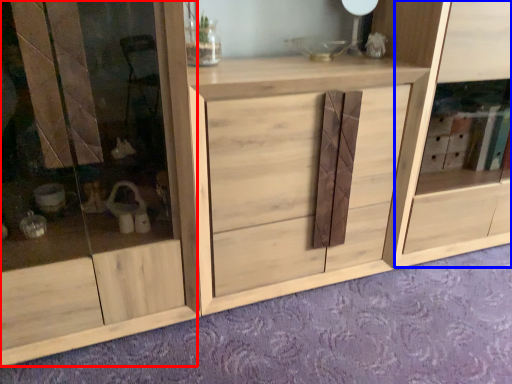
Question: Which point is closer to the camera, screen door (highlighted by a red box) or cabinet (highlighted by a blue box)?

Choices:
 (A) screen door
 (B) cabinet

Answer: (A)